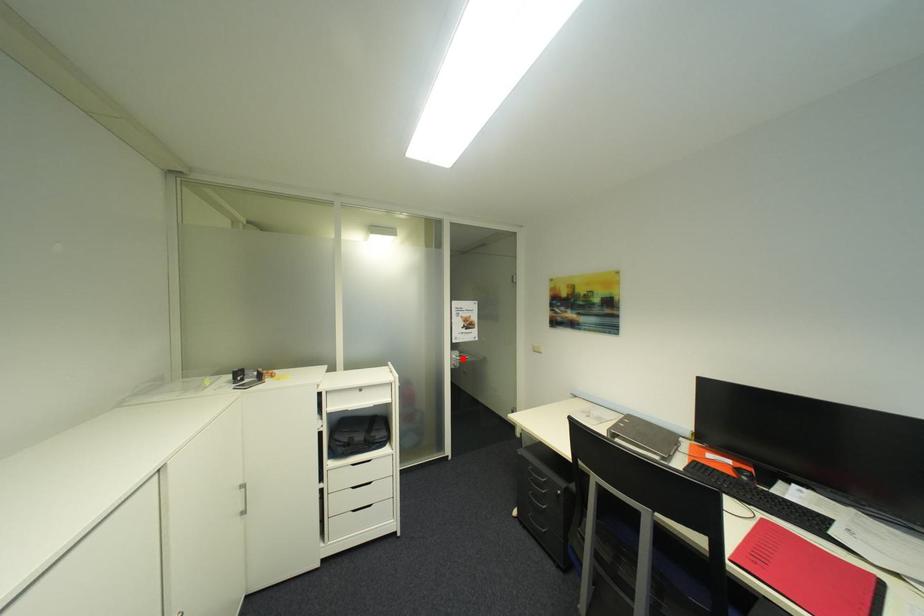
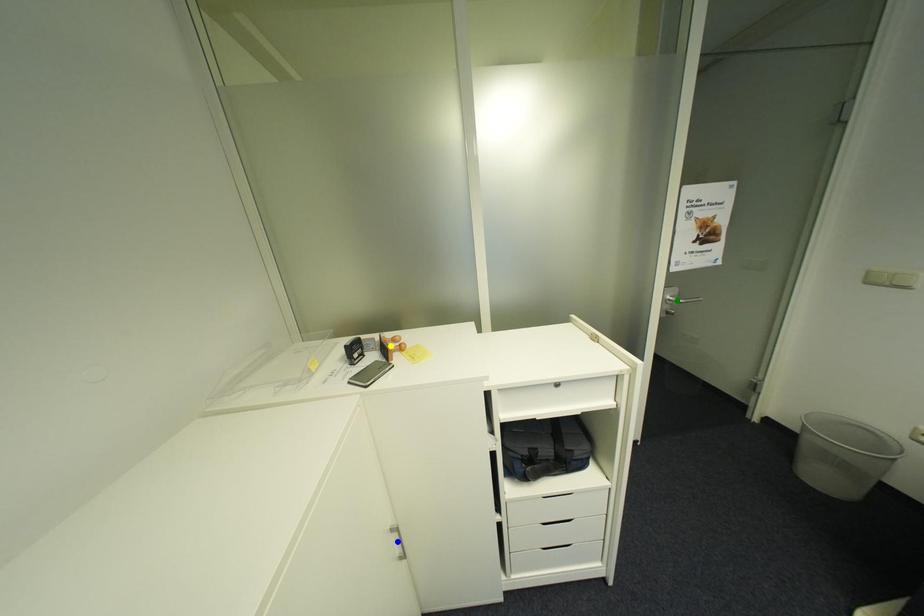
Question: I am providing you with two images of the same scene from different viewpoints. A red point is marked on the first image. You are given multiple points on the second image. Which mark in image 2 goes with the point in image 1?

Choices:
 (A) blue point
 (B) green point
 (C) yellow point

Answer: (B)